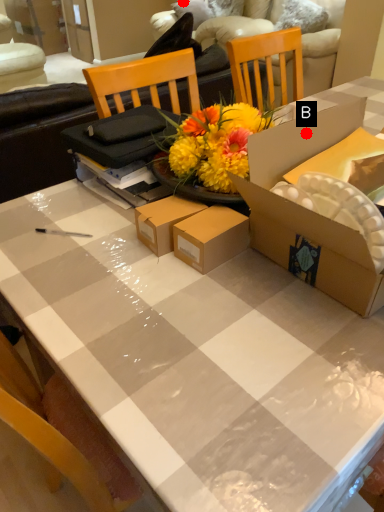
Question: Two points are circled on the image, labeled by A and B beside each circle. Which point appears closest to the camera in this image?

Choices:
 (A) A is closer
 (B) B is closer

Answer: (B)